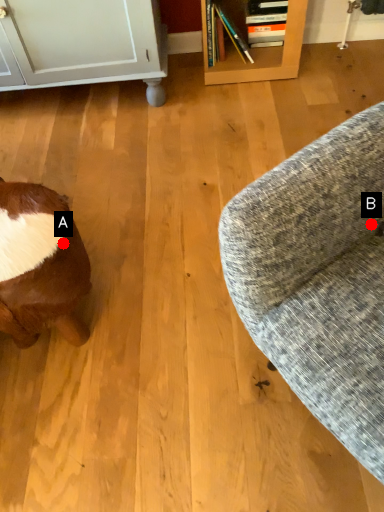
Question: Two points are circled on the image, labeled by A and B beside each circle. Among these points, which one is nearest to the camera?

Choices:
 (A) A is closer
 (B) B is closer

Answer: (B)